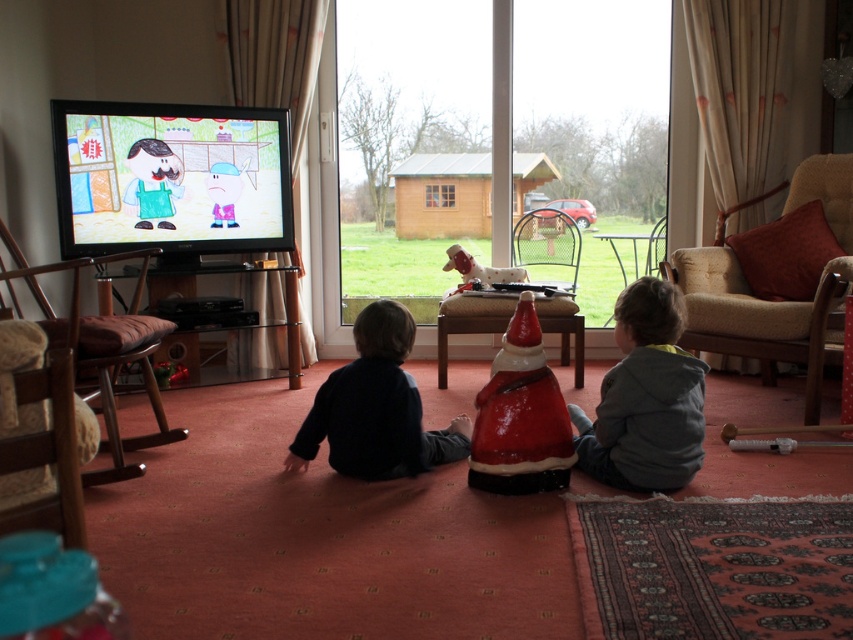
Does gray fleece jacket at lower right lie in front of dark blue sweater at center?

That is True.

Which is behind, point (675, 369) or point (323, 436)?

The point (323, 436) is more distant.

Identify the location of gray fleece jacket at lower right. The image size is (853, 640). (645, 397).